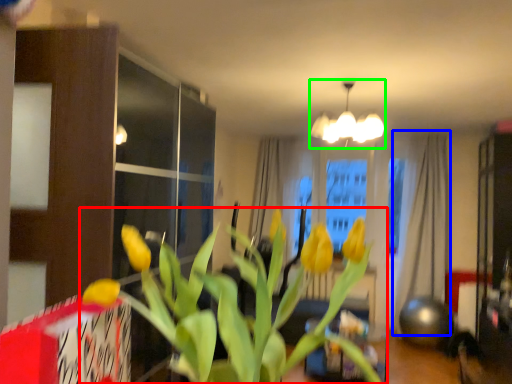
Question: Which object is positioned farthest from houseplant (highlighted by a red box)? Select from curtain (highlighted by a blue box) and lamp (highlighted by a green box).

Choices:
 (A) curtain
 (B) lamp

Answer: (A)